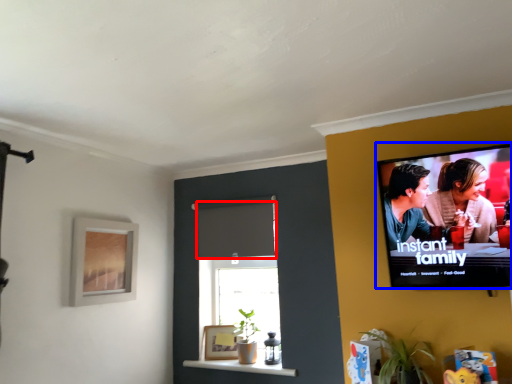
Question: Which point is closer to the camera, curtain (highlighted by a red box) or television (highlighted by a blue box)?

Choices:
 (A) curtain
 (B) television

Answer: (B)